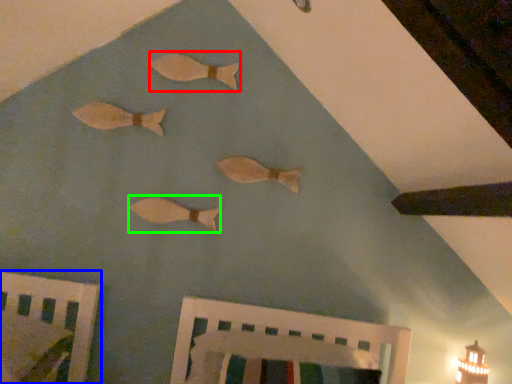
Question: Based on their relative distances, which object is nearer to fish (highlighted by a red box)? Choose from furniture (highlighted by a blue box) and fish (highlighted by a green box).

Choices:
 (A) furniture
 (B) fish

Answer: (B)